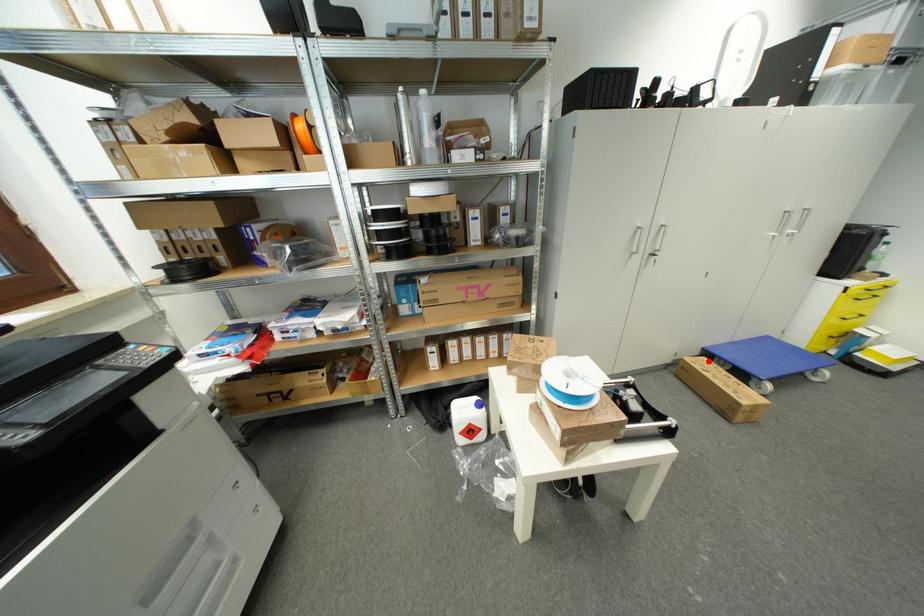
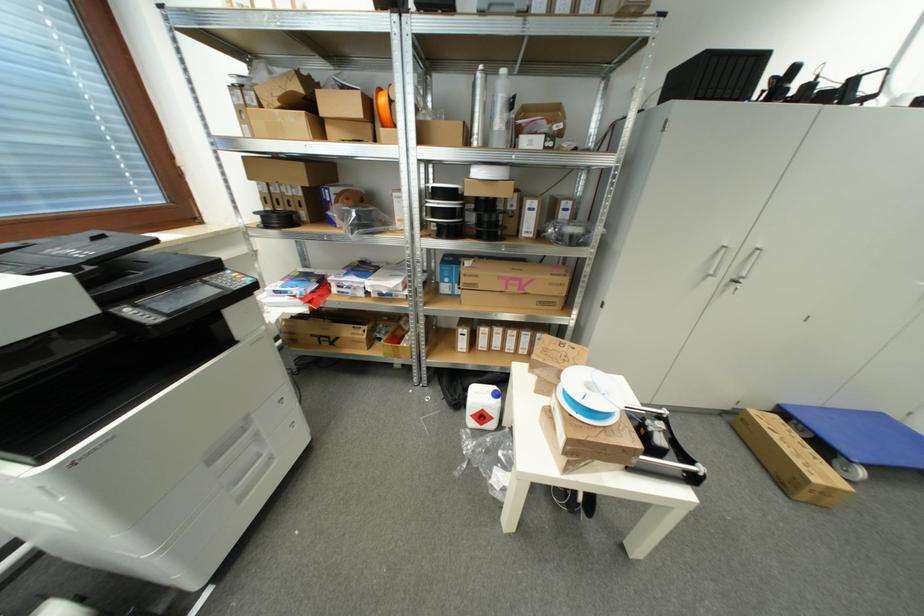
The point at the highlighted location is marked in the first image. Where is the corresponding point in the second image?

(781, 419)